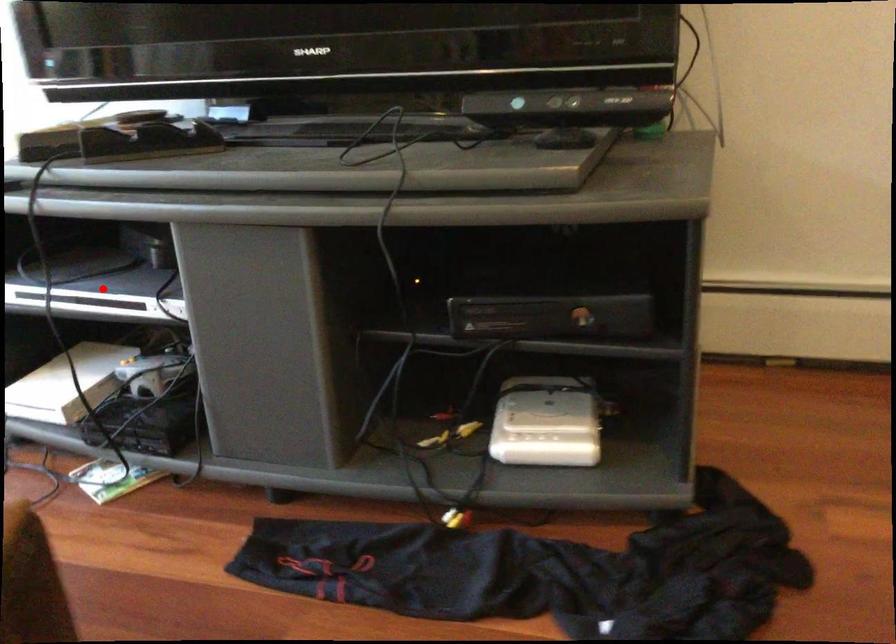
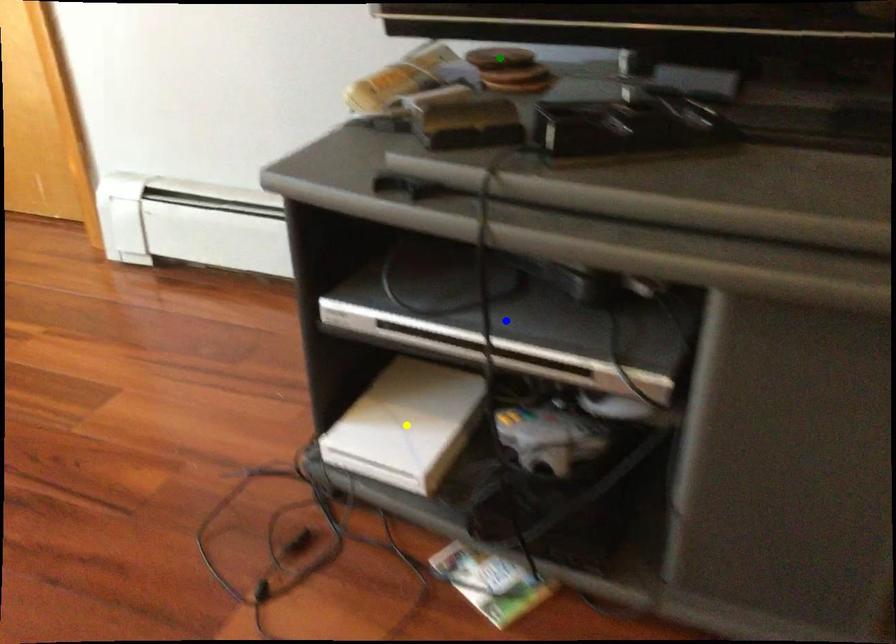
Question: I am providing you with two images of the same scene from different viewpoints. A red point is marked on the first image. You are given multiple points on the second image. Which point in image 2 is actually the same real-world point as the red point in image 1?

Choices:
 (A) blue point
 (B) yellow point
 (C) green point

Answer: (A)